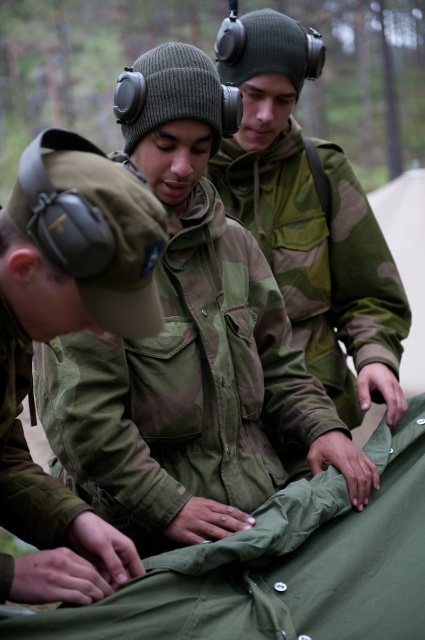
You are a photographer trying to capture a clear shot of the camouflage fabric jacket at upper center and the matte green uniform at center. Based on their positions, which object should you adjust your camera focus to first to ensure both are in frame?

Since the matte green uniform at center is to the left of the camouflage fabric jacket at upper center, you should focus on the camouflage fabric jacket at upper center first as it is positioned further to the right, allowing you to adjust the frame to include both objects without losing sight of them.

You are a drone operator trying to capture a closeup of two points on the ground in the scene. The points are labeled as point 1 at coordinate point (115, 481) and point 2 at coordinate point (147, 234). Which point should you adjust your drone to focus on to get a closer shot without moving the drone horizontally?

Point 1 at coordinate point (115, 481) is closer to the viewer than point 2 at coordinate point (147, 234), so you should focus on point 1 to get a closer shot without moving the drone horizontally.